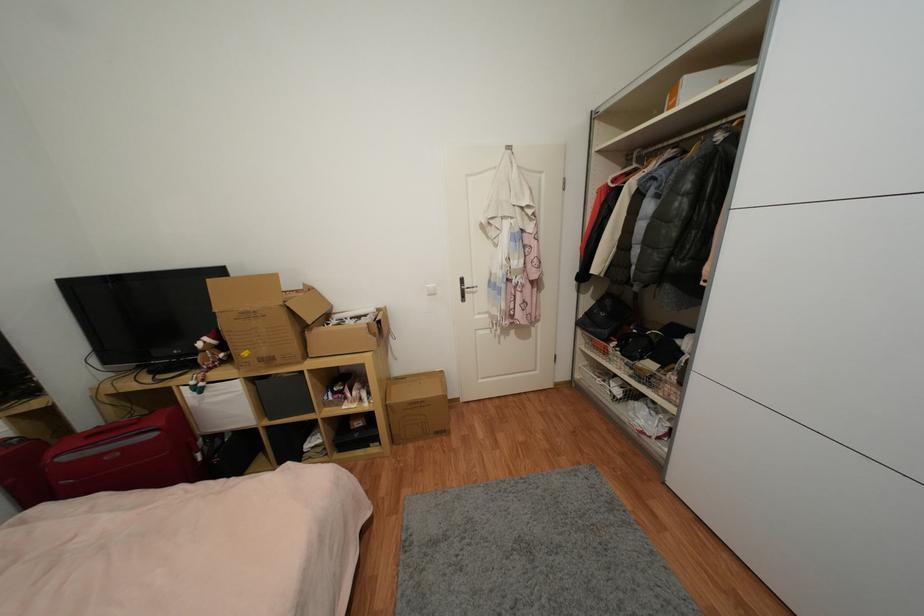
Where is `black door handle`? The image size is (924, 616). black door handle is located at coordinates (466, 289).